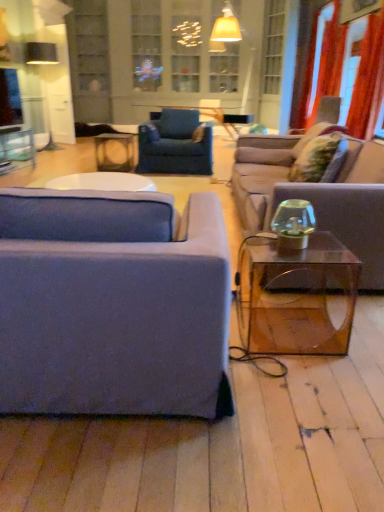
Question: Considering the relative positions of orange fabric curtain at upper right, arranged as the second curtain when viewed from the back, and velvet blue armchair at center in the image provided, is orange fabric curtain at upper right, arranged as the second curtain when viewed from the back, to the right of velvet blue armchair at center from the viewer's perspective?

Choices:
 (A) yes
 (B) no

Answer: (A)

Question: Is orange fabric curtain at upper right, marked as the first curtain in a front-to-back arrangement, oriented towards velvet blue armchair at center?

Choices:
 (A) no
 (B) yes

Answer: (B)

Question: Is orange fabric curtain at upper right, arranged as the second curtain when viewed from the back, surrounding velvet blue armchair at center?

Choices:
 (A) yes
 (B) no

Answer: (B)

Question: Does orange fabric curtain at upper right, arranged as the second curtain when viewed from the back, have a larger size compared to velvet blue armchair at center?

Choices:
 (A) yes
 (B) no

Answer: (B)

Question: Is orange fabric curtain at upper right, marked as the first curtain in a front-to-back arrangement, looking in the opposite direction of velvet blue armchair at center?

Choices:
 (A) yes
 (B) no

Answer: (B)

Question: From the image's perspective, does orange fabric curtain at upper right, marked as the first curtain in a front-to-back arrangement, appear higher than velvet blue armchair at center?

Choices:
 (A) yes
 (B) no

Answer: (A)

Question: From the image's perspective, is red velvet curtain at upper right, marked as the second curtain in a front-to-back arrangement, under matte blue fabric couch at left, placed as the 2th studio couch when sorted from right to left?

Choices:
 (A) yes
 (B) no

Answer: (B)

Question: Is matte blue fabric couch at left, which is counted as the first studio couch, starting from the left, located within red velvet curtain at upper right, marked as the second curtain in a front-to-back arrangement?

Choices:
 (A) no
 (B) yes

Answer: (A)

Question: Is red velvet curtain at upper right, acting as the first curtain starting from the back, positioned with its back to matte blue fabric couch at left, placed as the 2th studio couch when sorted from right to left?

Choices:
 (A) no
 (B) yes

Answer: (A)

Question: Is red velvet curtain at upper right, acting as the first curtain starting from the back, positioned behind matte blue fabric couch at left, the second studio couch in the back-to-front sequence?

Choices:
 (A) no
 (B) yes

Answer: (B)

Question: Is red velvet curtain at upper right, marked as the second curtain in a front-to-back arrangement, bigger than matte blue fabric couch at left, placed as the first studio couch when sorted from front to back?

Choices:
 (A) no
 (B) yes

Answer: (A)

Question: Can you confirm if red velvet curtain at upper right, marked as the second curtain in a front-to-back arrangement, is positioned to the right of matte blue fabric couch at left, placed as the 2th studio couch when sorted from right to left?

Choices:
 (A) no
 (B) yes

Answer: (B)

Question: Is transparent glass window screen at upper left looking in the opposite direction of clear glass cabinet at upper center?

Choices:
 (A) no
 (B) yes

Answer: (A)